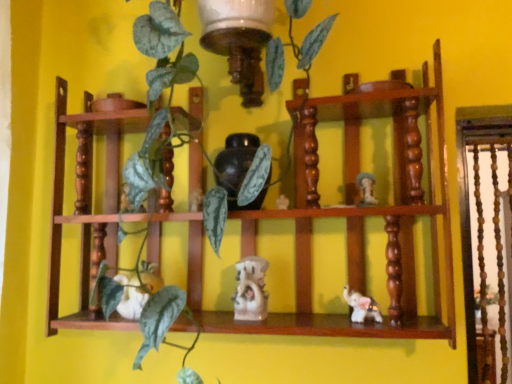
Question: Is matte black vase at center inside the boundaries of white glossy elephant at lower right, positioned as the second toy in right-to-left order, or outside?

Choices:
 (A) inside
 (B) outside

Answer: (B)

Question: From a real-world perspective, relative to white glossy elephant at lower right, positioned as the third toy in left-to-right order, is matte black vase at center vertically above or below?

Choices:
 (A) above
 (B) below

Answer: (A)

Question: Which object is the farthest from the white glossy elephant at lower right, positioned as the second toy in right-to-left order?

Choices:
 (A) white glossy statue at center, arranged as the 2th toy when viewed from the left
 (B) white matte rabbit at center, arranged as the first toy when viewed from the left
 (C) wooden shelf at center
 (D) matte black vase at center
 (E) white glossy mushroom at upper right, the first toy viewed from the right

Answer: (B)

Question: Which is nearer to the white glossy statue at center, arranged as the 3th toy when viewed from the right?

Choices:
 (A) wooden shelf at center
 (B) white glossy elephant at lower right, positioned as the third toy in left-to-right order
 (C) white glossy mushroom at upper right, the first toy viewed from the right
 (D) matte black vase at center
 (E) white matte rabbit at center, the fourth toy from the right

Answer: (D)